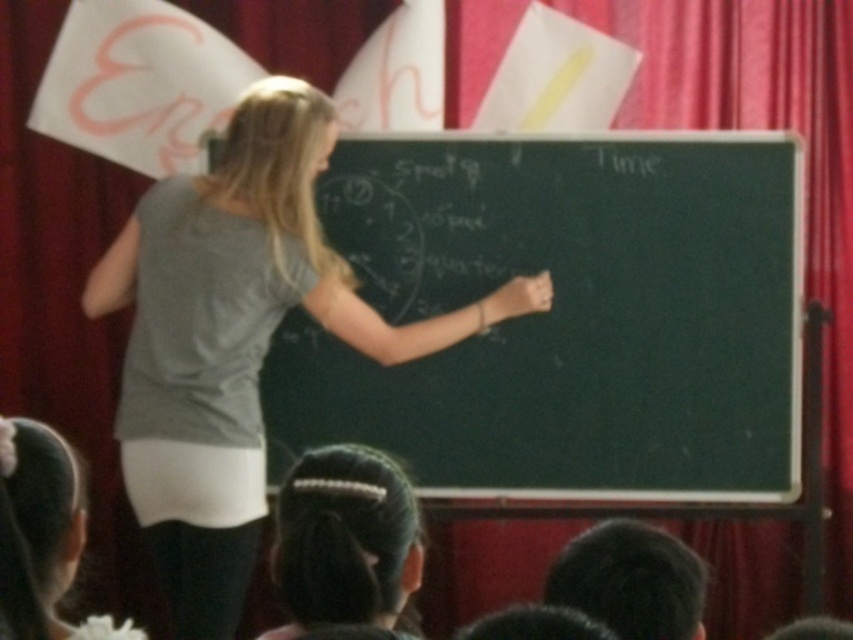
Who is positioned more to the right, black chalkboard at center or gray fabric shirt at center?

black chalkboard at center is more to the right.

Based on the photo, who is more forward, (451,216) or (234,524)?

Point (234,524)

You are a GUI agent. You are given a task and a screenshot of the screen. Output one action in this format:
    pyautogui.click(x=<x>, y=<y>)
    Task: Click on the black chalkboard at center
    
    Given the screenshot: What is the action you would take?
    pyautogui.click(x=564, y=316)

Where is `black chalkboard at center`? black chalkboard at center is located at coordinates (564, 316).

Can you confirm if gray fabric shirt at center is bigger than black hair at lower center?

Yes, gray fabric shirt at center is bigger than black hair at lower center.

Which is above, gray fabric shirt at center or black hair at lower center?

Positioned higher is gray fabric shirt at center.

The height and width of the screenshot is (640, 853). What do you see at coordinates (236, 337) in the screenshot?
I see `gray fabric shirt at center` at bounding box center [236, 337].

Locate an element on the screen. gray fabric shirt at center is located at coordinates (236, 337).

Which of these two, black chalkboard at center or black hair at lower center, stands shorter?

With less height is black hair at lower center.

Who is more distant from viewer, (480,189) or (415,566)?

Positioned behind is point (480,189).

Locate an element on the screen. This screenshot has width=853, height=640. black chalkboard at center is located at coordinates (564, 316).